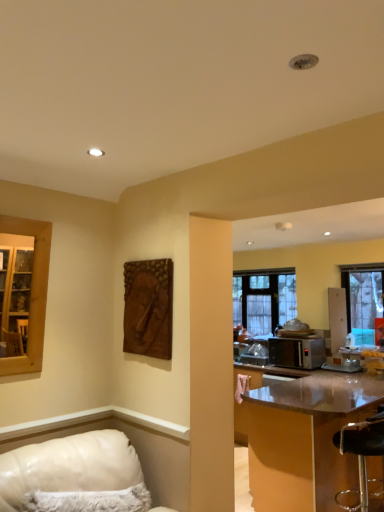
You are a GUI agent. You are given a task and a screenshot of the screen. Output one action in this format:
    pyautogui.click(x=<x>, y=<y>)
    Task: Click on the clear glass window at center, positioned as the first window in back-to-front order
    
    Given the screenshot: What is the action you would take?
    pyautogui.click(x=264, y=298)

Measure the distance between point [364,297] and camera.

4.88 meters.

What do you see at coordinates (297, 352) in the screenshot?
I see `satin silver microwave at right` at bounding box center [297, 352].

Identify the location of white leather couch at lower left. (74, 475).

Would you say shiny brown table at right is a long distance from transparent plastic bar stool at lower right?

→ No, shiny brown table at right is not far away from transparent plastic bar stool at lower right.

Relative to transparent plastic bar stool at lower right, is shiny brown table at right in front or behind?

shiny brown table at right is in front of transparent plastic bar stool at lower right.

Would you say shiny brown table at right is outside transparent plastic bar stool at lower right?

Yes, shiny brown table at right is outside of transparent plastic bar stool at lower right.

From a real-world perspective, between shiny brown table at right and transparent plastic bar stool at lower right, who is vertically higher?

shiny brown table at right.

Is point (24, 480) farther from viewer compared to point (284, 316)?

No, it is in front of (284, 316).

Is white leather couch at lower left taller or shorter than clear glass window at center, which is the 2th window from front to back?

white leather couch at lower left is shorter than clear glass window at center, which is the 2th window from front to back.

Considering the relative positions of white leather couch at lower left and clear glass window at center, marked as the second window in a right-to-left arrangement, in the image provided, is white leather couch at lower left to the left or to the right of clear glass window at center, marked as the second window in a right-to-left arrangement,?

white leather couch at lower left is to the left of clear glass window at center, marked as the second window in a right-to-left arrangement.

Does white leather couch at lower left have a greater width compared to clear glass window at center, positioned as the first window in back-to-front order?

Yes.

In order to click on furniture that is below the clear glass window at right, the 1th window when ordered from front to back (from the image's perspective) in this screenshot , I will do `click(74, 475)`.

Is clear glass window at right, the 1th window when ordered from front to back, spatially inside white leather couch at lower left, or outside of it?

clear glass window at right, the 1th window when ordered from front to back, is located beyond the bounds of white leather couch at lower left.

Does point (349, 328) come behind point (57, 477)?

Yes, it is behind point (57, 477).

From a real-world perspective, is clear glass window at center, marked as the second window in a right-to-left arrangement, under brown textured wood at upper center?

Yes, from a real-world perspective, clear glass window at center, marked as the second window in a right-to-left arrangement, is beneath brown textured wood at upper center.

Which point is more forward, (274,303) or (155,354)?

The point (155,354) is in front.

Based on the photo, is the depth of clear glass window at center, marked as the second window in a right-to-left arrangement, greater than that of brown textured wood at upper center?

Yes, the depth of clear glass window at center, marked as the second window in a right-to-left arrangement, is greater than that of brown textured wood at upper center.

Looking at this image, considering the relative sizes of clear glass window at center, positioned as the first window in back-to-front order, and brown textured wood at upper center in the image provided, is clear glass window at center, positioned as the first window in back-to-front order, thinner than brown textured wood at upper center?

No.

Between point (360, 373) and point (281, 362), which one is positioned behind?

The point (281, 362) is behind.

Is shiny brown table at right at the right side of satin silver microwave at right?

Yes, shiny brown table at right is to the right of satin silver microwave at right.

Considering the relative positions of shiny brown table at right and satin silver microwave at right in the image provided, is shiny brown table at right in front of satin silver microwave at right?

Yes, it is.

Which of these two, white leather couch at lower left or brown textured wood at upper center, stands shorter?

With less height is white leather couch at lower left.

From the image's perspective, relative to brown textured wood at upper center, is white leather couch at lower left above or below?

Clearly, from the image's perspective, white leather couch at lower left is below brown textured wood at upper center.

Between white leather couch at lower left and brown textured wood at upper center, which one appears on the left side from the viewer's perspective?

white leather couch at lower left is more to the left.

From a real-world perspective, which is physically below, white leather couch at lower left or brown textured wood at upper center?

white leather couch at lower left is physically lower.

Can you confirm if satin silver microwave at right is positioned to the left of white leather couch at lower left?

Result: In fact, satin silver microwave at right is to the right of white leather couch at lower left.

Are satin silver microwave at right and white leather couch at lower left located far from each other?

Yes, satin silver microwave at right is far from white leather couch at lower left.

Considering the points (279, 344) and (77, 454), which point is behind, point (279, 344) or point (77, 454)?

The point (279, 344) is more distant.

Is satin silver microwave at right aimed at white leather couch at lower left?

Yes.

What are the coordinates of `table lying below the transparent plastic bar stool at lower right (from the image's perspective)` in the screenshot? It's located at (305, 438).

The image size is (384, 512). What are the coordinates of `furniture that is on the left side of clear glass window at center, which is the 2th window from front to back` in the screenshot? It's located at click(74, 475).

When comparing their distances from white leather couch at lower left, does satin silver microwave at right or shiny brown table at right seem closer?

shiny brown table at right.

Considering their positions, is clear glass window at right, the 2th window when ordered from back to front, positioned further to clear glass window at center, marked as the second window in a right-to-left arrangement, than brown textured wood at upper center?

brown textured wood at upper center is further to clear glass window at center, marked as the second window in a right-to-left arrangement.

Estimate the real-world distances between objects in this image. Which object is closer to clear glass window at right, the 2th window when ordered from back to front, clear glass window at center, acting as the 1th window starting from the left, or satin silver microwave at right?

Based on the image, satin silver microwave at right appears to be nearer to clear glass window at right, the 2th window when ordered from back to front.

When comparing their distances from transparent plastic bar stool at lower right, does white leather couch at lower left or brown textured wood at upper center seem further?

Based on the image, white leather couch at lower left appears to be further to transparent plastic bar stool at lower right.

Based on their spatial positions, is clear glass window at right, the 2th window when ordered from back to front, or satin silver microwave at right closer to shiny brown table at right?

satin silver microwave at right is positioned closer to the anchor shiny brown table at right.

Based on their spatial positions, is satin silver microwave at right or white leather couch at lower left further from clear glass window at center, positioned as the first window in back-to-front order?

white leather couch at lower left lies further to clear glass window at center, positioned as the first window in back-to-front order, than the other object.

Looking at the image, which one is located further to brown textured wood at upper center, transparent plastic bar stool at lower right or clear glass window at right, placed as the first window when sorted from right to left?

The object further to brown textured wood at upper center is clear glass window at right, placed as the first window when sorted from right to left.

Looking at the image, which one is located further to shiny brown table at right, satin silver microwave at right or brown textured wood at upper center?

The object further to shiny brown table at right is brown textured wood at upper center.

In order to click on picture frame positioned between white leather couch at lower left and clear glass window at right, placed as the first window when sorted from right to left, from near to far in this screenshot , I will do point(148,308).

At what (x,y) coordinates should I click in order to perform the action: click on microwave oven between white leather couch at lower left and clear glass window at right, the 2th window from the left, along the z-axis. Please return your answer as a coordinate pair (x, y). The image size is (384, 512). Looking at the image, I should click on (297, 352).

At what (x,y) coordinates should I click in order to perform the action: click on table located between brown textured wood at upper center and clear glass window at center, positioned as the first window in back-to-front order, in the depth direction. Please return your answer as a coordinate pair (x, y). Image resolution: width=384 pixels, height=512 pixels. Looking at the image, I should click on (305, 438).

Identify the location of microwave oven between white leather couch at lower left and clear glass window at center, acting as the 1th window starting from the left, in the front-back direction. (297, 352).